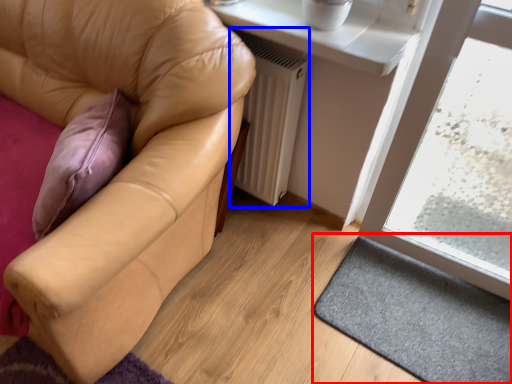
Question: Which object is closer to the camera taking this photo, doormat (highlighted by a red box) or radiator (highlighted by a blue box)?

Choices:
 (A) doormat
 (B) radiator

Answer: (A)